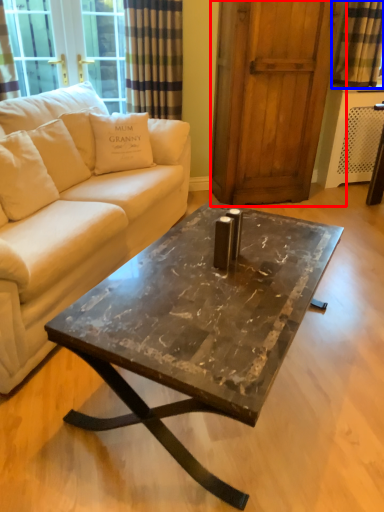
Question: Which object appears closest to the camera in this image, screen door (highlighted by a red box) or curtain (highlighted by a blue box)?

Choices:
 (A) screen door
 (B) curtain

Answer: (A)